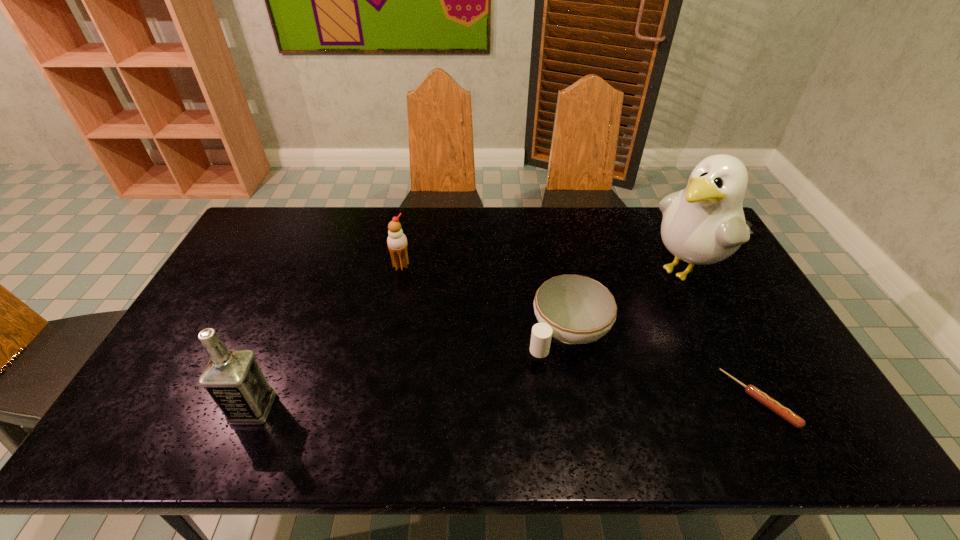
The image size is (960, 540). I want to click on vacant space situated 0.160m on the front label of the leftmost object, so coord(168,408).

Locate an element on the screen. The image size is (960, 540). vacant space located on the right of the shortest object is located at coordinates (816, 400).

Where is `vacant area situated on the side with the handle of the chinaware`? The width and height of the screenshot is (960, 540). vacant area situated on the side with the handle of the chinaware is located at coordinates coord(486,406).

I want to click on vacant space located 0.210m on the side with the handle of the chinaware, so click(x=486, y=406).

Identify the location of free space located 0.120m on the side with the handle of the chinaware. The image size is (960, 540). (511, 383).

I want to click on free space located 0.130m at the front with a straw on the icecream, so click(x=429, y=292).

Locate an element on the screen. This screenshot has height=540, width=960. vacant space located at the front with a straw on the icecream is located at coordinates (468, 329).

At what (x,y) coordinates should I click in order to perform the action: click on free space located 0.280m at the front with a straw on the icecream. Please return your answer as a coordinate pair (x, y). Looking at the image, I should click on (459, 321).

Locate an element on the screen. Image resolution: width=960 pixels, height=540 pixels. free space located 0.350m on the beak of the gull is located at coordinates tap(578, 340).

Identify the location of vacant space located on the beak of the gull. This screenshot has height=540, width=960. click(596, 328).